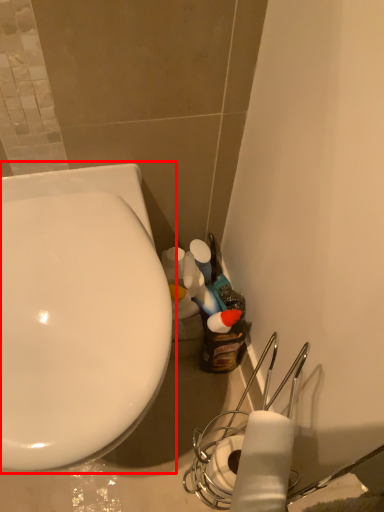
Question: From the image's perspective, where is toilet (annotated by the red box) located relative to toilet paper?

Choices:
 (A) below
 (B) above

Answer: (B)